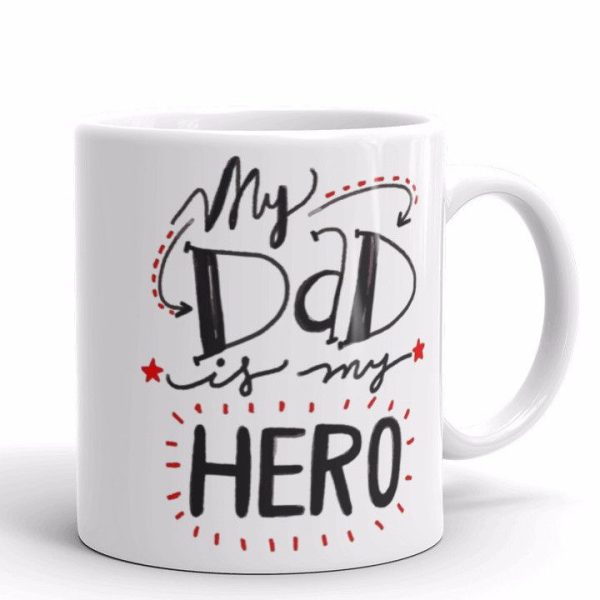
The height and width of the screenshot is (600, 600). Find the location of `top edge of mug`. top edge of mug is located at coordinates (334, 132), (163, 129), (293, 107).